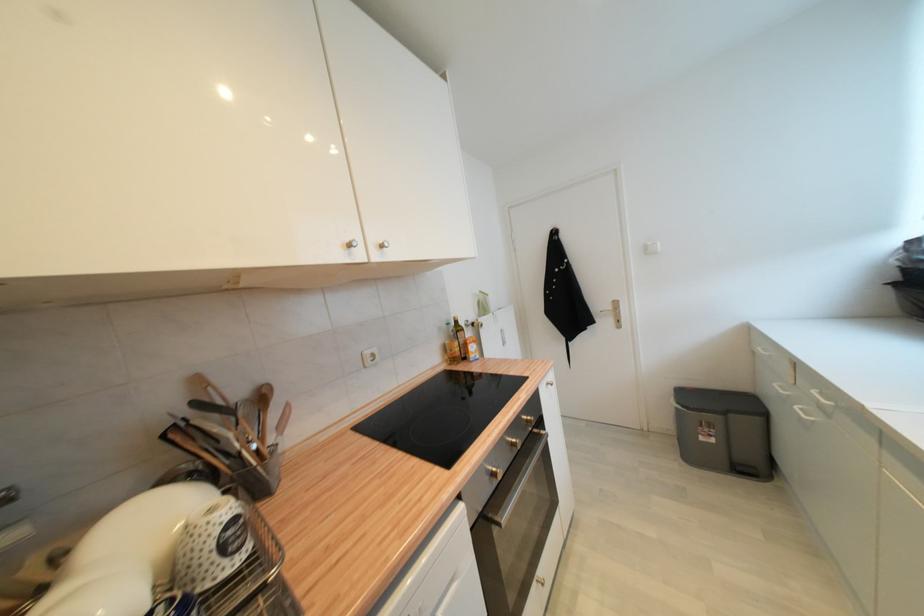
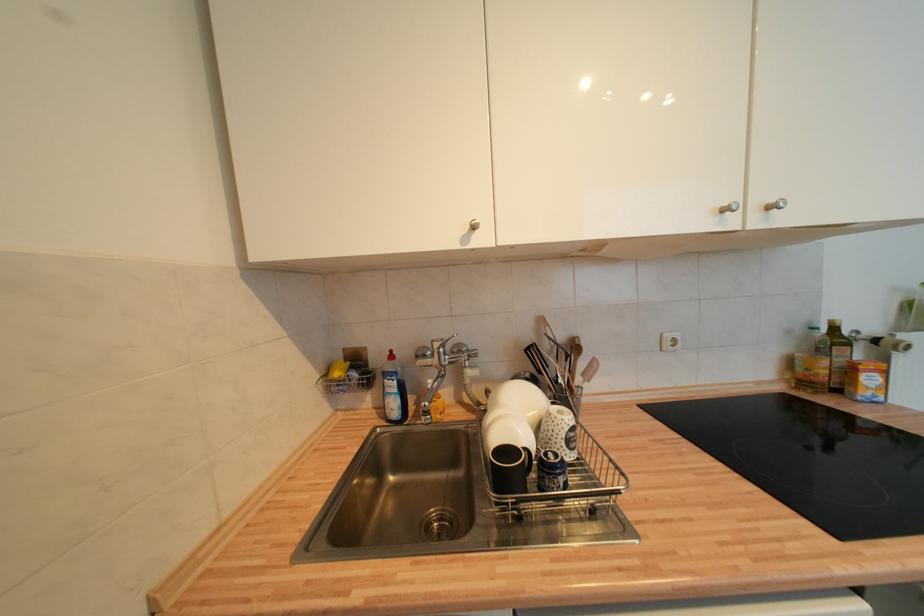
Locate, in the second image, the point that corresponds to (387,248) in the first image.

(775, 209)